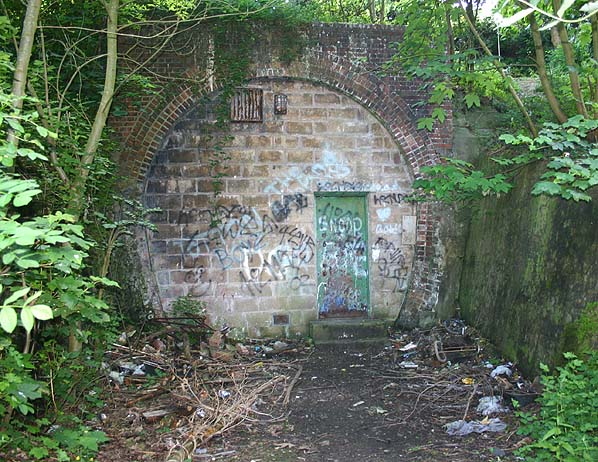
Where is `smaller vent`? Image resolution: width=598 pixels, height=462 pixels. smaller vent is located at coordinates (280, 316).